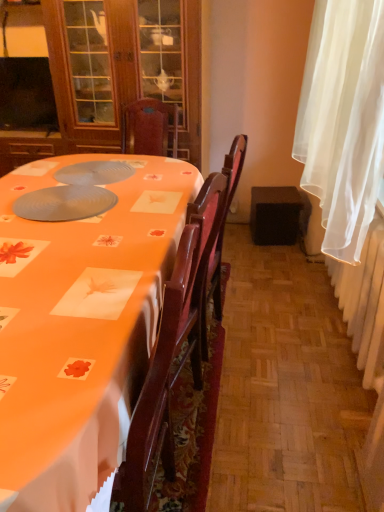
Question: Is point (59, 205) positioned closer to the camera than point (74, 58)?

Choices:
 (A) farther
 (B) closer

Answer: (B)

Question: Based on their positions, is matte gray paper plate at center located to the left or right of matte wood cabinet at upper left?

Choices:
 (A) left
 (B) right

Answer: (B)

Question: Which of these objects is positioned closest to the black fabric speaker at lower right?

Choices:
 (A) orange fabric-covered table at lower left
 (B) white sheer curtain at right
 (C) matte wood cabinet at upper left
 (D) matte gray paper plate at center
 (E) white fabric radiator at right

Answer: (E)

Question: Estimate the real-world distances between objects in this image. Which object is closer to the white fabric radiator at right?

Choices:
 (A) matte wood cabinet at upper left
 (B) matte gray paper plate at center
 (C) white sheer curtain at right
 (D) black fabric speaker at lower right
 (E) orange fabric-covered table at lower left

Answer: (C)